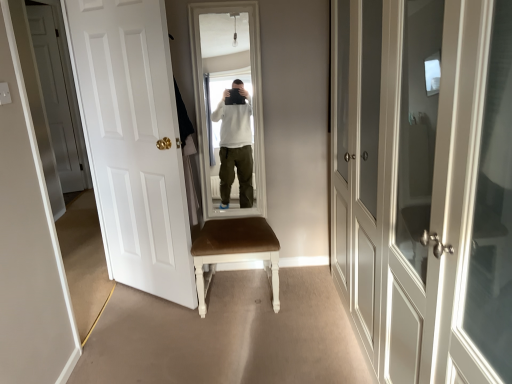
Question: From the image's perspective, would you say white glossy door at left, which ranks as the 2th door in front-to-back order, is shown under white glossy cabinet doors at right, placed as the first door when sorted from right to left?

Choices:
 (A) no
 (B) yes

Answer: (A)

Question: Is the position of white glossy door at left, which ranks as the 2th door in front-to-back order, more distant than that of white glossy cabinet doors at right, the 3th door positioned from the left?

Choices:
 (A) yes
 (B) no

Answer: (A)

Question: Is white glossy door at left, acting as the second door starting from the back, to the left of white glossy cabinet doors at right, placed as the first door when sorted from front to back, from the viewer's perspective?

Choices:
 (A) no
 (B) yes

Answer: (B)

Question: Is white glossy cabinet doors at right, placed as the first door when sorted from front to back, surrounded by white glossy door at left, acting as the second door starting from the back?

Choices:
 (A) yes
 (B) no

Answer: (B)

Question: From the image's perspective, is white glossy door at left, acting as the second door starting from the back, on top of white glossy cabinet doors at right, the 3th door positioned from the left?

Choices:
 (A) yes
 (B) no

Answer: (A)

Question: From the image's perspective, is white matte door at left, acting as the first door starting from the back, above or below white glossy door at left, marked as the second door in a right-to-left arrangement?

Choices:
 (A) above
 (B) below

Answer: (A)

Question: Is white matte door at left, acting as the first door starting from the back, inside or outside of white glossy door at left, acting as the second door starting from the back?

Choices:
 (A) outside
 (B) inside

Answer: (A)

Question: From a real-world perspective, is white matte door at left, the 1th door when ordered from left to right, positioned above or below white glossy door at left, acting as the second door starting from the back?

Choices:
 (A) below
 (B) above

Answer: (B)

Question: Visually, is white matte door at left, acting as the first door starting from the back, positioned to the left or to the right of white glossy door at left, the 2th door in the left-to-right sequence?

Choices:
 (A) left
 (B) right

Answer: (A)

Question: Does point (462, 107) appear closer or farther from the camera than point (172, 137)?

Choices:
 (A) closer
 (B) farther

Answer: (A)

Question: In terms of height, does white glossy cabinet doors at right, which is the third door in back-to-front order, look taller or shorter compared to white glossy door at left, the 2th door in the left-to-right sequence?

Choices:
 (A) tall
 (B) short

Answer: (B)

Question: Is white glossy cabinet doors at right, placed as the first door when sorted from right to left, inside the boundaries of white glossy door at left, acting as the second door starting from the back, or outside?

Choices:
 (A) inside
 (B) outside

Answer: (B)

Question: From the image's perspective, is white glossy cabinet doors at right, placed as the first door when sorted from front to back, positioned above or below white glossy door at left, acting as the second door starting from the back?

Choices:
 (A) above
 (B) below

Answer: (B)

Question: In terms of width, does white glossy door at left, which ranks as the 2th door in front-to-back order, look wider or thinner when compared to brown leather chair at center?

Choices:
 (A) wide
 (B) thin

Answer: (B)

Question: Does point (159, 183) appear closer or farther from the camera than point (223, 231)?

Choices:
 (A) farther
 (B) closer

Answer: (B)